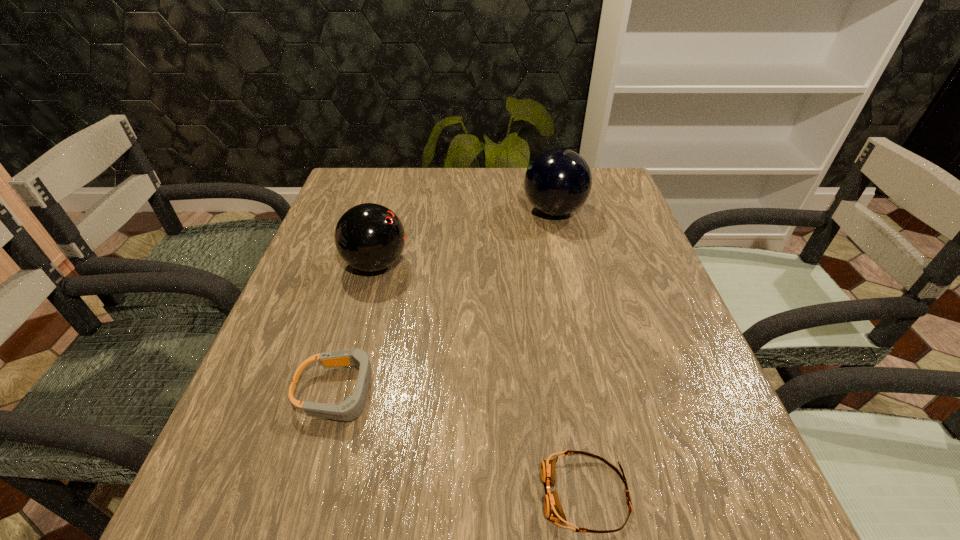
Locate an element on the screen. The image size is (960, 540). the second closest object to the farther bowling ball is located at coordinates (350, 409).

Locate which object ranks second in proximity to the taller goggles. Please provide its 2D coordinates. Your answer should be formatted as a tuple, i.e. [(x, y)], where the tuple contains the x and y coordinates of a point satisfying the conditions above.

[(553, 509)]